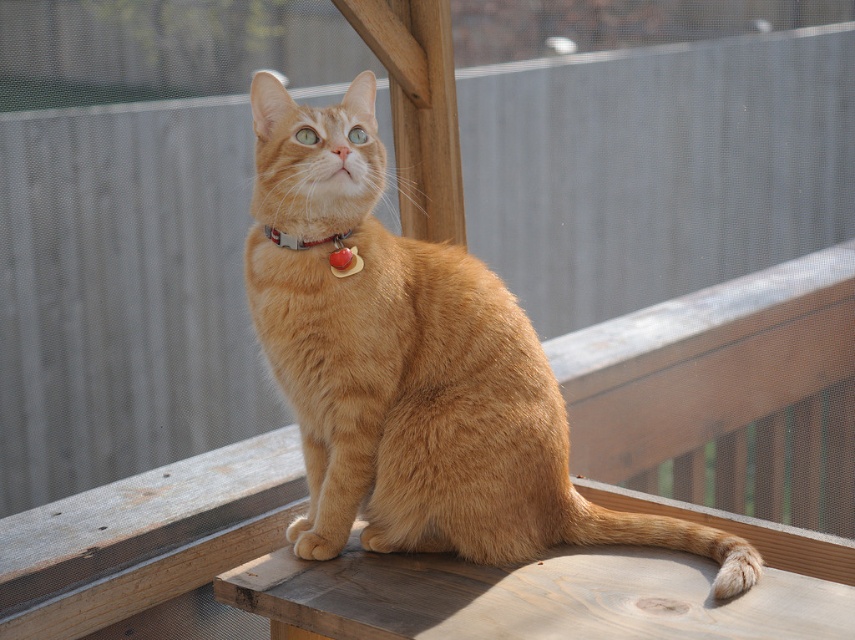
You are a photographer trying to capture the orange fur cat at center and the metallic silver collar at center in a single shot. Based on their positions, which object is closer to the camera?

The orange fur cat at center is located below the metallic silver collar at center, so the metallic silver collar at center is closer to the camera.

You are a photographer taking a picture of the orange fur cat at center and the metallic silver collar at center. Which object will appear larger in your photo?

The orange fur cat at center will appear larger in the photo because it is closer to the viewer than the metallic silver collar at center.

You are taking a photo of the ginger cat and notice two points in the image labeled as point (354, 262) and point (351, 232). Which point is closer to the camera?

Point (354, 262) is closer to the camera than point (351, 232).